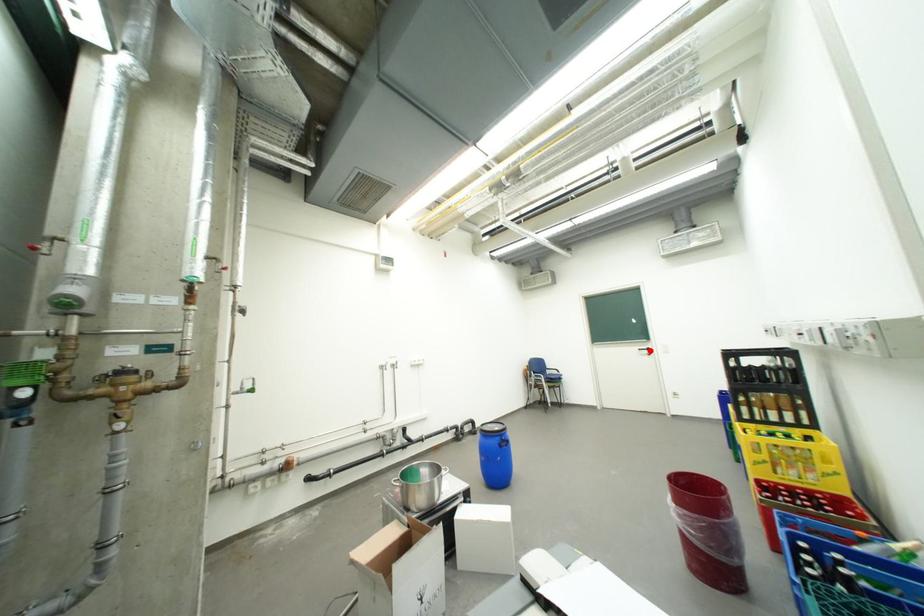
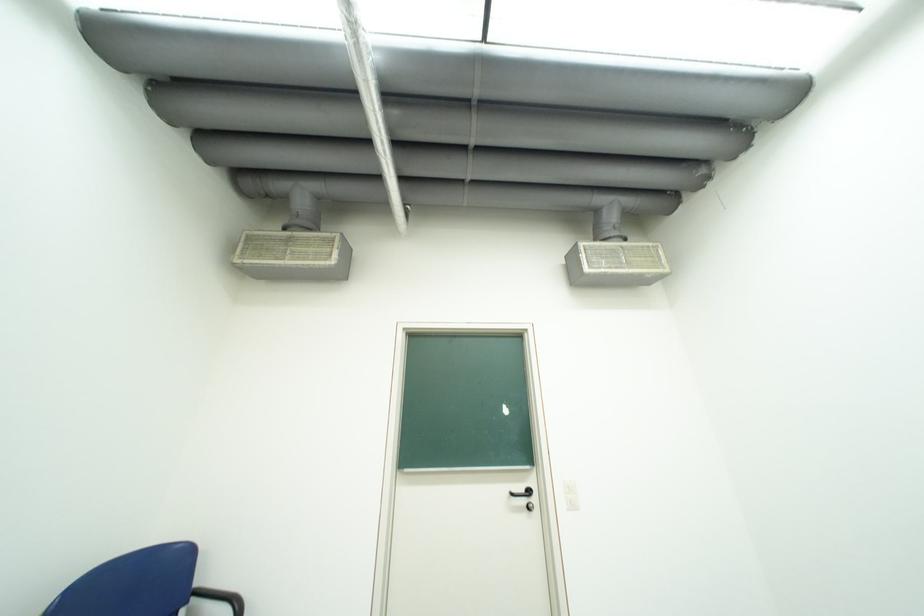
The point at the highlighted location is marked in the first image. Where is the corresponding point in the second image?

(523, 495)